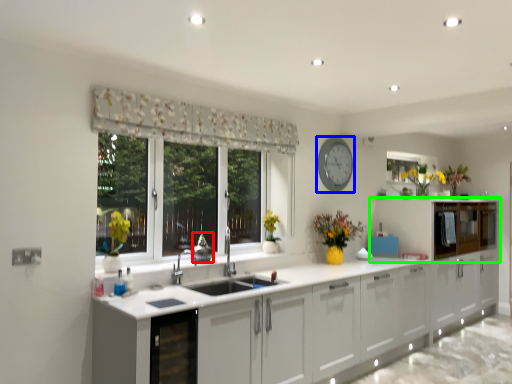
Question: Considering the real-world distances, which object is farthest from appliance (highlighted by a red box)? clock (highlighted by a blue box) or cabinetry (highlighted by a green box)?

Choices:
 (A) clock
 (B) cabinetry

Answer: (B)